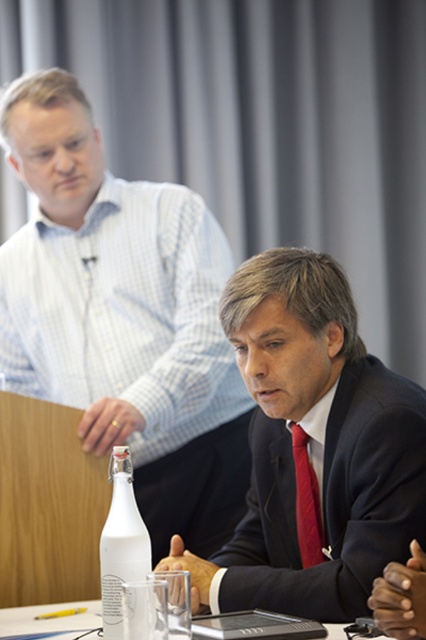
Question: Which point is closer to the camera?

Choices:
 (A) (127, 486)
 (B) (54, 333)
 (C) (273, 522)

Answer: (A)

Question: Among these points, which one is nearest to the camera?

Choices:
 (A) (322, 531)
 (B) (48, 339)
 (C) (123, 534)
 (D) (34, 605)

Answer: (C)

Question: Can you confirm if white glossy bottle at left is bigger than red silk tie at center?

Choices:
 (A) yes
 (B) no

Answer: (A)

Question: Does white glass bottle at center have a larger size compared to red silk tie at center?

Choices:
 (A) no
 (B) yes

Answer: (B)

Question: Which object is closer to the camera taking this photo?

Choices:
 (A) white plastic bottle at center
 (B) red silk tie at center

Answer: (A)

Question: Does matte black suit at center appear under white plastic bottle at center?

Choices:
 (A) no
 (B) yes

Answer: (A)